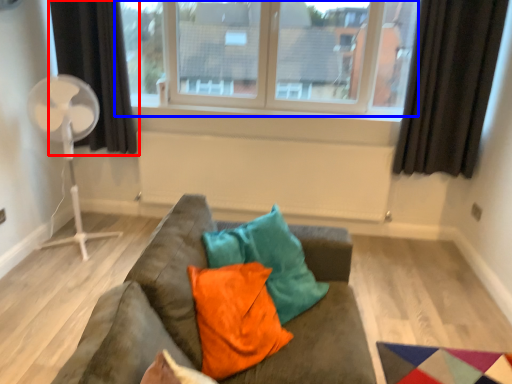
Question: Which of the following is the farthest to the observer, curtain (highlighted by a red box) or window (highlighted by a blue box)?

Choices:
 (A) curtain
 (B) window

Answer: (A)